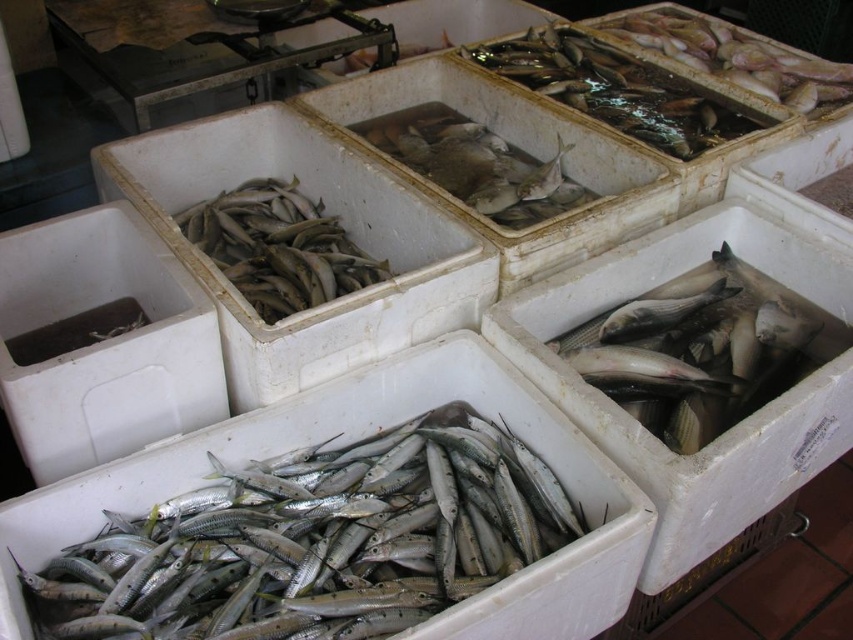
Is silver shiny fish at right bigger than silvery-scaled fish at center?

Yes.

Describe the element at coordinates (704, 349) in the screenshot. I see `silver shiny fish at right` at that location.

Describe the element at coordinates (704, 349) in the screenshot. I see `silver shiny fish at right` at that location.

Locate an element on the screen. silver shiny fish at right is located at coordinates (704, 349).

The width and height of the screenshot is (853, 640). What do you see at coordinates (450, 150) in the screenshot? I see `silvery-scaled fish at center` at bounding box center [450, 150].

Is silvery-scaled fish at center closer to camera compared to shiny silver fish at upper right?

Yes, silvery-scaled fish at center is closer to the viewer.

Measure the distance between silvery-scaled fish at center and camera.

silvery-scaled fish at center is 5.87 feet from camera.

This screenshot has width=853, height=640. Identify the location of silvery-scaled fish at center. (450, 150).

Measure the distance between silver metallic fish at lower left and camera.

silver metallic fish at lower left and camera are 3.77 feet apart from each other.

Find the location of `silver metallic fish at lower left`. silver metallic fish at lower left is located at coordinates (314, 541).